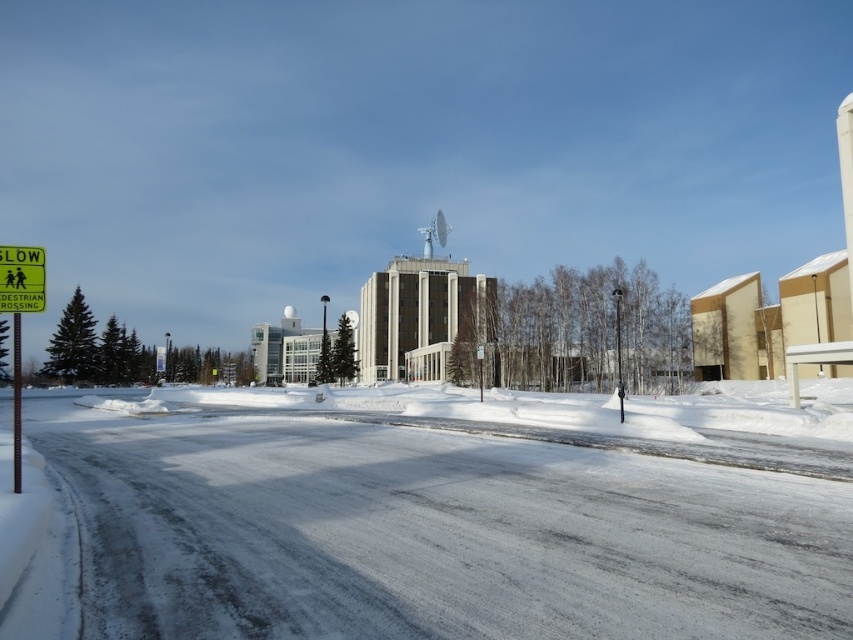
You are a pedestrian standing on the snowy road and see the yellow plastic sign at left and the metallic pole at left. Which object is nearer to you?

The yellow plastic sign at left is closer to the viewer than the metallic pole at left, so the yellow plastic sign at left is nearer to you.

You are driving a car with a width of 2 meters and need to cross the road. The road has white powdery snow at center and a yellow plastic sign at left. Can your car fit through the road between these two objects without touching them? Please explain your reasoning.

The white powdery snow at center is wider than the yellow plastic sign at left. However, the description does not provide specific measurements for either object, so it is impossible to determine if the car can fit through the road between them without additional information.

You are driving a car and approaching the yellow plastic sign at left and the metallic pole at left. Which object is narrower from your perspective?

The yellow plastic sign at left is thinner than the metallic pole at left, so the yellow plastic sign at left is narrower.